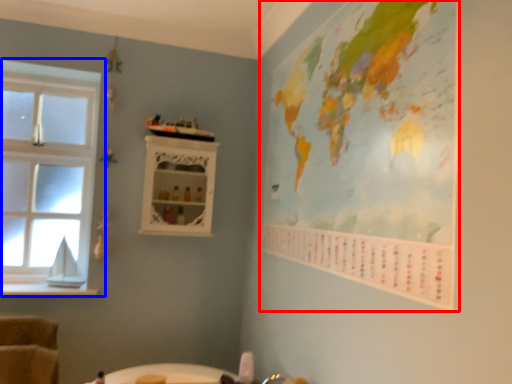
Question: Which point is closer to the camera, map (highlighted by a red box) or window (highlighted by a blue box)?

Choices:
 (A) map
 (B) window

Answer: (A)